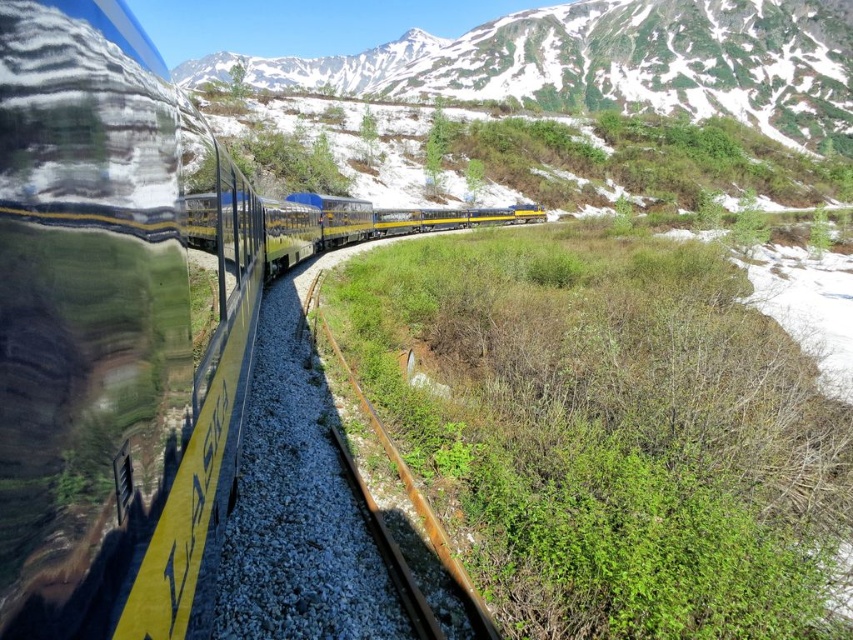
Question: Does yellow polished metal train at left appear on the left side of rusty metal train track at center?

Choices:
 (A) yes
 (B) no

Answer: (A)

Question: Which point appears closest to the camera in this image?

Choices:
 (A) (422, 504)
 (B) (170, 145)

Answer: (B)

Question: Can you confirm if yellow polished metal train at left is positioned above rusty metal train track at center?

Choices:
 (A) no
 (B) yes

Answer: (B)

Question: Is yellow polished metal train at left thinner than rusty metal train track at center?

Choices:
 (A) no
 (B) yes

Answer: (A)

Question: Which object appears farthest from the camera in this image?

Choices:
 (A) rusty metal train track at center
 (B) yellow polished metal train at left

Answer: (A)

Question: Which of the following is the farthest from the observer?

Choices:
 (A) (254, 257)
 (B) (463, 602)

Answer: (A)